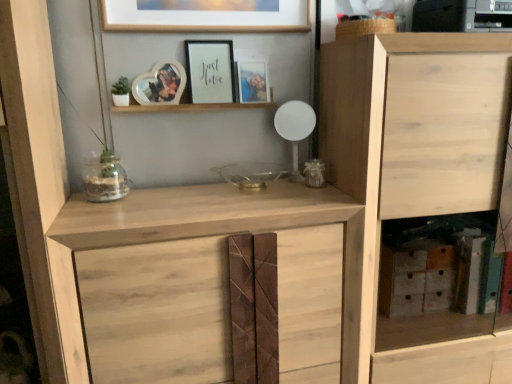
Question: From a real-world perspective, is natural wood cabinet at right, which is the first cupboard from right to left, over clear glass vase at center?

Choices:
 (A) yes
 (B) no

Answer: (B)

Question: Does natural wood cabinet at right, the second cupboard in the left-to-right sequence, have a lesser width compared to clear glass vase at center?

Choices:
 (A) no
 (B) yes

Answer: (A)

Question: Is natural wood cabinet at right, the second cupboard in the left-to-right sequence, not inside clear glass vase at center?

Choices:
 (A) no
 (B) yes

Answer: (B)

Question: From the image's perspective, is natural wood cabinet at right, the second cupboard in the left-to-right sequence, located beneath clear glass vase at center?

Choices:
 (A) yes
 (B) no

Answer: (A)

Question: Does natural wood cabinet at right, which is the first cupboard from right to left, have a larger size compared to clear glass vase at center?

Choices:
 (A) no
 (B) yes

Answer: (B)

Question: Does natural wood cabinet at right, which is the first cupboard from right to left, appear on the right side of clear glass vase at center?

Choices:
 (A) yes
 (B) no

Answer: (A)

Question: Is clear glass vase at center further to camera compared to natural wood cupboard at center, positioned as the first cupboard in left-to-right order?

Choices:
 (A) no
 (B) yes

Answer: (B)

Question: Is clear glass vase at center outside natural wood cupboard at center, positioned as the first cupboard in left-to-right order?

Choices:
 (A) yes
 (B) no

Answer: (A)

Question: Is natural wood cupboard at center, the second cupboard positioned from the right, located within clear glass vase at center?

Choices:
 (A) yes
 (B) no

Answer: (B)

Question: Can you confirm if clear glass vase at center is thinner than natural wood cupboard at center, positioned as the first cupboard in left-to-right order?

Choices:
 (A) no
 (B) yes

Answer: (B)

Question: Does clear glass vase at center appear on the left side of natural wood cupboard at center, positioned as the first cupboard in left-to-right order?

Choices:
 (A) yes
 (B) no

Answer: (A)

Question: Does clear glass vase at center have a greater width compared to natural wood cupboard at center, positioned as the first cupboard in left-to-right order?

Choices:
 (A) no
 (B) yes

Answer: (A)

Question: Is natural wood cabinet at right, which is the first cupboard from right to left, completely or partially outside of matte wooden photo frame at upper center, arranged as the first picture frame when viewed from the right?

Choices:
 (A) no
 (B) yes

Answer: (B)